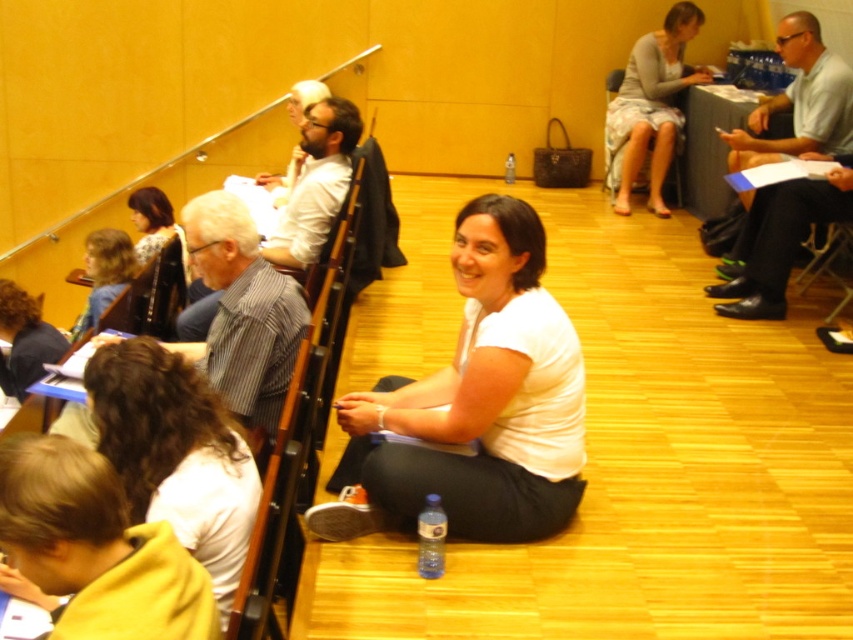
You are standing in the conference room and want to take a photo of both the point at coordinates (x=109, y=280) and the point at coordinates (x=132, y=246). Which point should you focus on first to ensure both are in focus?

You should focus on the point at coordinates (x=109, y=280) first because it is closer to the camera than the point at coordinates (x=132, y=246). This ensures that both points will be in focus when using a camera with a fixed focal length.

You are standing in the conference room and want to hand a document to both the person wearing the white cotton shirt at center and the person wearing the white fabric shirt at lower left. Which person should you approach first to ensure you can reach them without moving past the other?

You should approach the white cotton shirt at center first because they are closer to you than the white fabric shirt at lower left, which is further away.